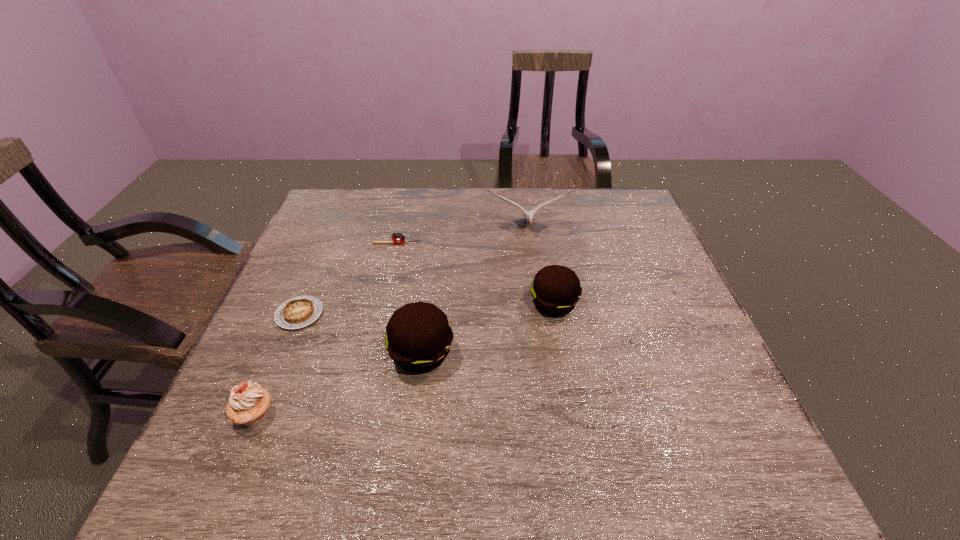
Where is `unoccupied position between the gull and the second farthest object`? unoccupied position between the gull and the second farthest object is located at coordinates (463, 236).

Find the location of a particular element. Image resolution: width=960 pixels, height=540 pixels. vacant space that is in between the nearer patty and the cupcake is located at coordinates (338, 384).

Identify the location of blank region between the right patty and the tape measure. Image resolution: width=960 pixels, height=540 pixels. (475, 274).

Identify which object is the third closest to the taller patty. Please provide its 2D coordinates. Your answer should be formatted as a tuple, i.e. [(x, y)], where the tuple contains the x and y coordinates of a point satisfying the conditions above.

[(249, 404)]

The width and height of the screenshot is (960, 540). Find the location of `object that can be found as the second closest to the cupcake`. object that can be found as the second closest to the cupcake is located at coordinates (418, 338).

Where is `free region that satisfies the following two spatial constraints: 1. on the back side of the cupcake; 2. on the left side of the quiche`? free region that satisfies the following two spatial constraints: 1. on the back side of the cupcake; 2. on the left side of the quiche is located at coordinates (297, 314).